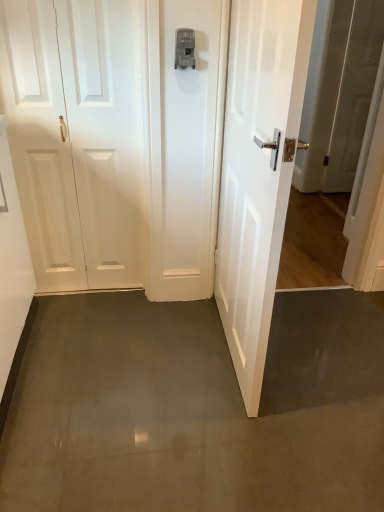
Describe the element at coordinates (258, 172) in the screenshot. I see `white glossy door at right, which appears as the first door when viewed from the right` at that location.

Where is `white glossy door at right, which appears as the first door when viewed from the right`? white glossy door at right, which appears as the first door when viewed from the right is located at coordinates (258, 172).

I want to click on matte gray latch at center, so click(184, 48).

Describe the element at coordinates (76, 139) in the screenshot. This screenshot has width=384, height=512. I see `white glossy door at left, the second door from the right` at that location.

Find the location of a particular element. This screenshot has height=512, width=384. white glossy door at right, which appears as the first door when viewed from the right is located at coordinates (258, 172).

Based on their sizes in the image, would you say matte gray latch at center is bigger or smaller than white glossy door at left, the second door from the right?

Considering their sizes, matte gray latch at center takes up less space than white glossy door at left, the second door from the right.

Is matte gray latch at center facing away from white glossy door at left, the second door from the right?

No, white glossy door at left, the second door from the right, is not at the back of matte gray latch at center.

The image size is (384, 512). I want to click on latch above the white glossy door at left, the 1th door positioned from the left (from the image's perspective), so click(x=184, y=48).

Does matte gray latch at center have a greater width compared to white glossy door at left, the 1th door positioned from the left?

Yes.

Considering the sizes of white glossy door at left, the 1th door positioned from the left, and matte gray latch at center in the image, is white glossy door at left, the 1th door positioned from the left, taller or shorter than matte gray latch at center?

Considering their sizes, white glossy door at left, the 1th door positioned from the left, has more height than matte gray latch at center.

In the scene shown: From a real-world perspective, does white glossy door at left, the second door from the right, stand above matte gray latch at center?

No, from a real-world perspective, white glossy door at left, the second door from the right, is not on top of matte gray latch at center.

Who is bigger, white glossy door at left, the second door from the right, or matte gray latch at center?

With larger size is white glossy door at left, the second door from the right.

Can you confirm if white glossy door at left, the 1th door positioned from the left, is positioned to the left of matte gray latch at center?

Correct, you'll find white glossy door at left, the 1th door positioned from the left, to the left of matte gray latch at center.

Can matte gray latch at center be found inside white glossy door at right, the 2th door in the left-to-right sequence?

That's incorrect, matte gray latch at center is not inside white glossy door at right, the 2th door in the left-to-right sequence.

How many degrees apart are the facing directions of white glossy door at right, the 2th door in the left-to-right sequence, and matte gray latch at center?

They differ by 87.5 degrees in their facing directions.

Considering the relative sizes of white glossy door at right, which appears as the first door when viewed from the right, and matte gray latch at center in the image provided, is white glossy door at right, which appears as the first door when viewed from the right, shorter than matte gray latch at center?

Incorrect, the height of white glossy door at right, which appears as the first door when viewed from the right, does not fall short of that of matte gray latch at center.

This screenshot has height=512, width=384. I want to click on latch behind the white glossy door at right, which appears as the first door when viewed from the right, so click(x=184, y=48).

Would you say matte gray latch at center contains white glossy door at right, the 2th door in the left-to-right sequence?

No, white glossy door at right, the 2th door in the left-to-right sequence, is not inside matte gray latch at center.

From the picture: Can you confirm if matte gray latch at center is wider than white glossy door at right, the 2th door in the left-to-right sequence?

In fact, matte gray latch at center might be narrower than white glossy door at right, the 2th door in the left-to-right sequence.

How different are the orientations of matte gray latch at center and white glossy door at right, which appears as the first door when viewed from the right, in degrees?

87.5 degrees.

From a real-world perspective, relative to white glossy door at right, which appears as the first door when viewed from the right, is matte gray latch at center vertically above or below?

Clearly, from a real-world perspective, matte gray latch at center is above white glossy door at right, which appears as the first door when viewed from the right.

Based on the photo, from a real-world perspective, which object rests below the other?

white glossy door at left, the 1th door positioned from the left, from a real-world perspective.

In the image, is white glossy door at left, the second door from the right, on the left side or the right side of white glossy door at right, which appears as the first door when viewed from the right?

Clearly, white glossy door at left, the second door from the right, is on the left of white glossy door at right, which appears as the first door when viewed from the right, in the image.

In the image, there is a white glossy door at right, which appears as the first door when viewed from the right. Identify the location of door below it (from a real-world perspective). Image resolution: width=384 pixels, height=512 pixels. (76, 139).

From a real-world perspective, which object rests below the other?

white glossy door at left, the 1th door positioned from the left, is physically lower.

Does white glossy door at right, the 2th door in the left-to-right sequence, lie behind white glossy door at left, the 1th door positioned from the left?

That is False.

Considering the positions of objects white glossy door at right, the 2th door in the left-to-right sequence, and white glossy door at left, the second door from the right, in the image provided, who is more to the left, white glossy door at right, the 2th door in the left-to-right sequence, or white glossy door at left, the second door from the right,?

Positioned to the left is white glossy door at left, the second door from the right.

I want to click on latch located on the right of white glossy door at left, the 1th door positioned from the left, so click(x=184, y=48).

Identify the location of latch in front of the white glossy door at left, the 1th door positioned from the left. The height and width of the screenshot is (512, 384). (184, 48).

In the scene shown: Which object lies nearer to the anchor point white glossy door at left, the second door from the right, white glossy door at right, the 2th door in the left-to-right sequence, or matte gray latch at center?

matte gray latch at center.

Based on their spatial positions, is matte gray latch at center or white glossy door at left, the 1th door positioned from the left, closer to white glossy door at right, the 2th door in the left-to-right sequence?

matte gray latch at center is positioned closer to the anchor white glossy door at right, the 2th door in the left-to-right sequence.

In the scene shown: Which object lies nearer to the anchor point matte gray latch at center, white glossy door at right, which appears as the first door when viewed from the right, or white glossy door at left, the 1th door positioned from the left?

white glossy door at left, the 1th door positioned from the left, is positioned closer to the anchor matte gray latch at center.

Looking at the image, which one is located closer to white glossy door at right, the 2th door in the left-to-right sequence, white glossy door at left, the second door from the right, or matte gray latch at center?

matte gray latch at center.

Looking at the image, which one is located closer to white glossy door at left, the second door from the right, matte gray latch at center or white glossy door at right, which appears as the first door when viewed from the right?

matte gray latch at center is closer to white glossy door at left, the second door from the right.

Which object lies further to the anchor point matte gray latch at center, white glossy door at left, the 1th door positioned from the left, or white glossy door at right, which appears as the first door when viewed from the right?

Based on the image, white glossy door at right, which appears as the first door when viewed from the right, appears to be further to matte gray latch at center.

You are a GUI agent. You are given a task and a screenshot of the screen. Output one action in this format:
    pyautogui.click(x=<x>, y=<y>)
    Task: Click on the latch between white glossy door at left, the second door from the right, and white glossy door at right, the 2th door in the left-to-right sequence
    
    Given the screenshot: What is the action you would take?
    pyautogui.click(x=184, y=48)